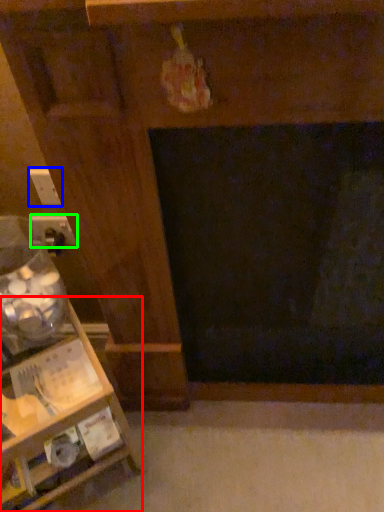
Question: Considering the real-world distances, which object is closest to furniture (highlighted by a red box)? electric outlet (highlighted by a blue box) or electric outlet (highlighted by a green box).

Choices:
 (A) electric outlet
 (B) electric outlet

Answer: (B)